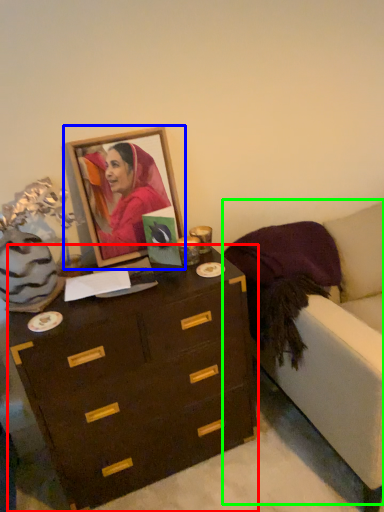
Question: Which object is positioned farthest from chest of drawers (highlighted by a red box)? Select from picture frame (highlighted by a blue box) and armchair (highlighted by a green box).

Choices:
 (A) picture frame
 (B) armchair

Answer: (A)